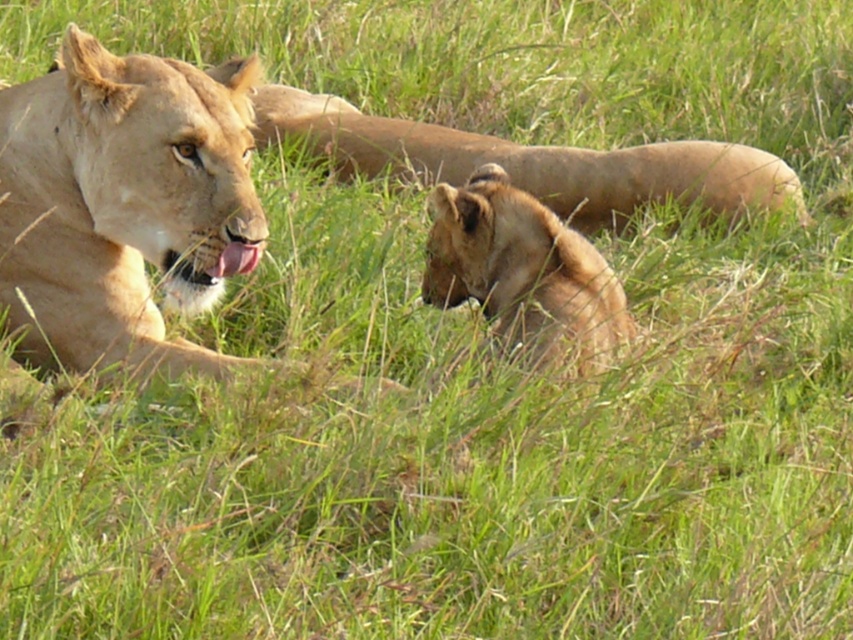
You are a wildlife photographer trying to capture a photo of the light brown fur lion at left and the golden fur lion at center. You want to ensure both lions are clearly visible in your shot. Given their sizes, which lion might you need to adjust your camera focus for more carefully?

The light brown fur lion at left is thinner than the golden fur lion at center, so you might need to adjust your camera focus more carefully for the light brown fur lion at left since it is smaller and could be harder to distinguish against the background.

You are a wildlife photographer observing two golden fur lions in the grass. You notice the golden fur lion at center and the golden fur lion cub at center. Which one is positioned higher in the image?

The golden fur lion at center is above the golden fur lion cub at center, so it is positioned higher in the image.

From the picture: You are a wildlife photographer aiming to capture a closeup of the light brown fur lion at left. You are currently standing at point (123, 205). Can you take the photo from your current position?

Yes, you can take the photo from your current position at point (123, 205) since the light brown fur lion at left is located exactly at that point.